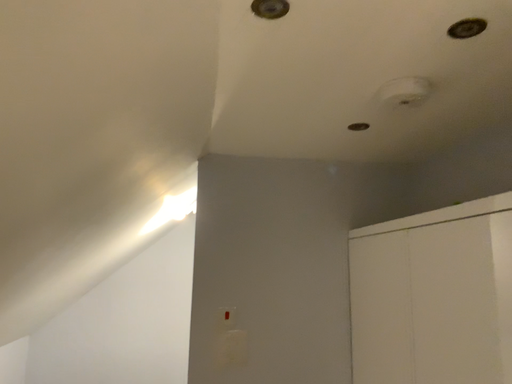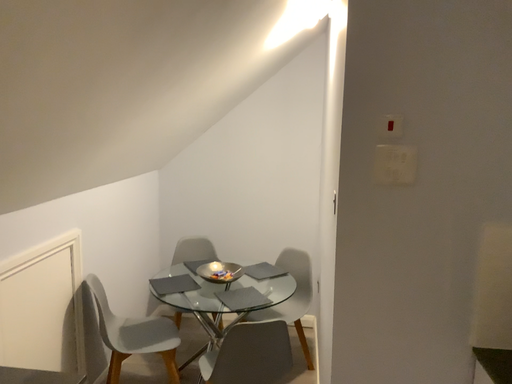
Question: How did the camera likely rotate when shooting the video?

Choices:
 (A) rotated downward
 (B) rotated upward

Answer: (A)